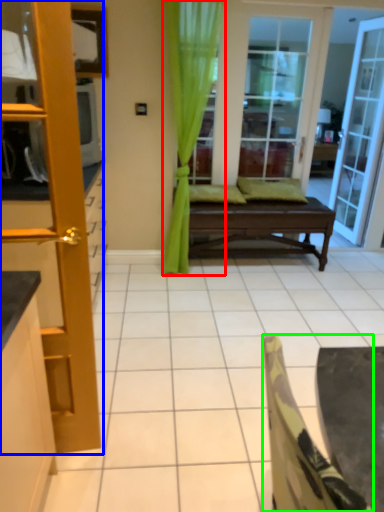
Question: Considering the real-world distances, which object is closest to curtain (highlighted by a red box)? door (highlighted by a blue box) or chair (highlighted by a green box).

Choices:
 (A) door
 (B) chair

Answer: (A)